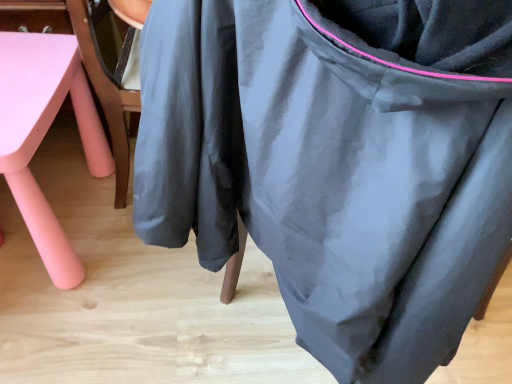
Question: Should I look upward or downward to see matte pink table at lower left?

Choices:
 (A) down
 (B) up

Answer: (B)

Question: Are matte pink table at lower left and matte black bean bag chair at center located far from each other?

Choices:
 (A) no
 (B) yes

Answer: (A)

Question: From a real-world perspective, is matte pink table at lower left located beneath matte black bean bag chair at center?

Choices:
 (A) yes
 (B) no

Answer: (A)

Question: Can you confirm if matte pink table at lower left is thinner than matte black bean bag chair at center?

Choices:
 (A) yes
 (B) no

Answer: (A)

Question: Does matte pink table at lower left touch matte black bean bag chair at center?

Choices:
 (A) yes
 (B) no

Answer: (B)

Question: Considering the relative sizes of matte pink table at lower left and matte black bean bag chair at center in the image provided, is matte pink table at lower left wider than matte black bean bag chair at center?

Choices:
 (A) yes
 (B) no

Answer: (B)

Question: Is matte pink table at lower left positioned in front of matte black bean bag chair at center?

Choices:
 (A) no
 (B) yes

Answer: (A)

Question: Is matte black bean bag chair at center completely or partially outside of matte pink table at lower left?

Choices:
 (A) no
 (B) yes

Answer: (B)

Question: From a real-world perspective, is matte black bean bag chair at center under matte pink table at lower left?

Choices:
 (A) yes
 (B) no

Answer: (B)

Question: Is the position of matte black bean bag chair at center more distant than that of matte pink table at lower left?

Choices:
 (A) no
 (B) yes

Answer: (A)

Question: Does matte black bean bag chair at center appear on the left side of matte pink table at lower left?

Choices:
 (A) yes
 (B) no

Answer: (B)

Question: Does matte black bean bag chair at center lie in front of matte pink table at lower left?

Choices:
 (A) no
 (B) yes

Answer: (B)

Question: Is matte black bean bag chair at center thinner than matte pink table at lower left?

Choices:
 (A) yes
 (B) no

Answer: (B)

Question: In terms of height, does matte pink table at lower left look taller or shorter compared to matte black bean bag chair at center?

Choices:
 (A) tall
 (B) short

Answer: (B)